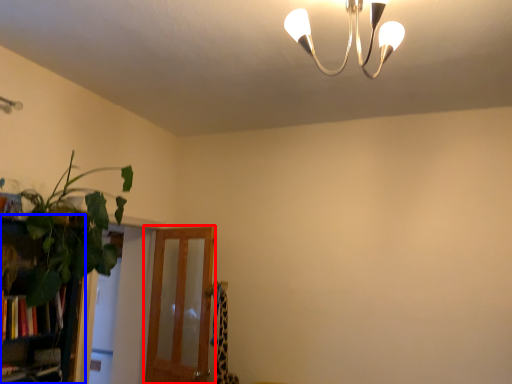
Question: Which object appears farthest to the camera in this image, screen door (highlighted by a red box) or bookshelf (highlighted by a blue box)?

Choices:
 (A) screen door
 (B) bookshelf

Answer: (A)